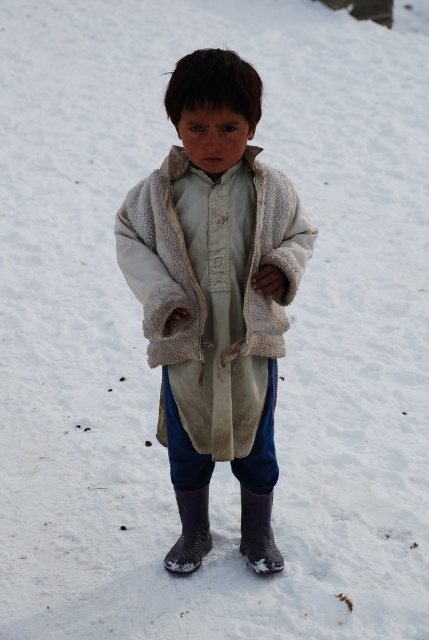
Question: Among these objects, which one is farthest from the camera?

Choices:
 (A) fuzzy beige coat at center
 (B) rubber/matte boot at lower center
 (C) rubber/mesh boot at lower center

Answer: (C)

Question: Does rubber/mesh boot at lower center appear on the right side of rubber/matte boot at lower center?

Choices:
 (A) no
 (B) yes

Answer: (A)

Question: Among these objects, which one is nearest to the camera?

Choices:
 (A) rubber/matte boot at lower center
 (B) rubber/mesh boot at lower center
 (C) fuzzy beige coat at center

Answer: (C)

Question: Does fuzzy beige coat at center appear on the right side of rubber/mesh boot at lower center?

Choices:
 (A) yes
 (B) no

Answer: (A)

Question: Can you confirm if rubber/mesh boot at lower center is positioned above rubber/matte boot at lower center?

Choices:
 (A) yes
 (B) no

Answer: (A)

Question: Estimate the real-world distances between objects in this image. Which object is closer to the fuzzy beige coat at center?

Choices:
 (A) rubber/mesh boot at lower center
 (B) rubber/matte boot at lower center

Answer: (A)